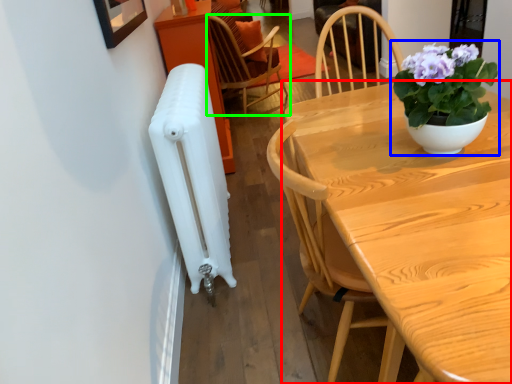
Question: Based on their relative distances, which object is farther from table (highlighted by a red box)? Choose from houseplant (highlighted by a blue box) and chair (highlighted by a green box).

Choices:
 (A) houseplant
 (B) chair

Answer: (B)